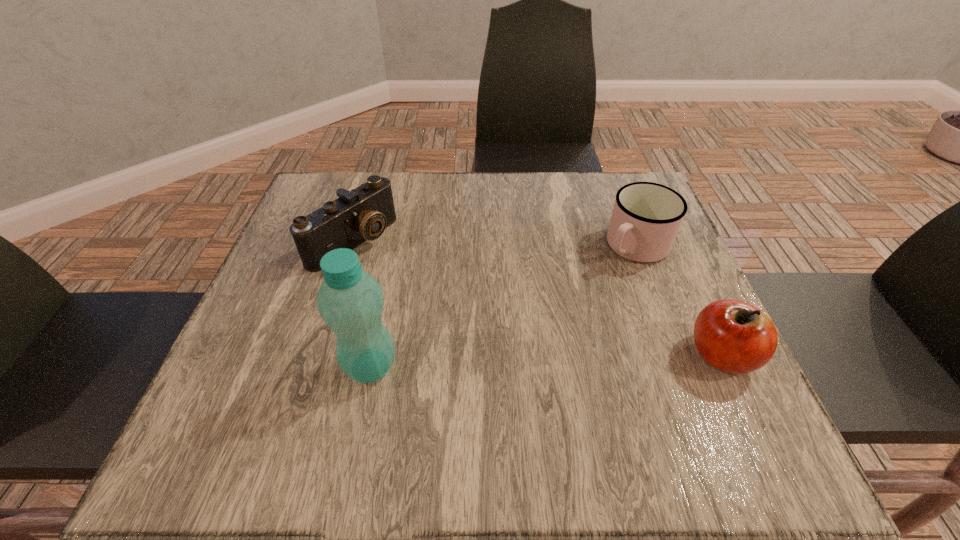
Identify the location of free location that satisfies the following two spatial constraints: 1. on the front side of the apple; 2. on the left side of the mug. (677, 355).